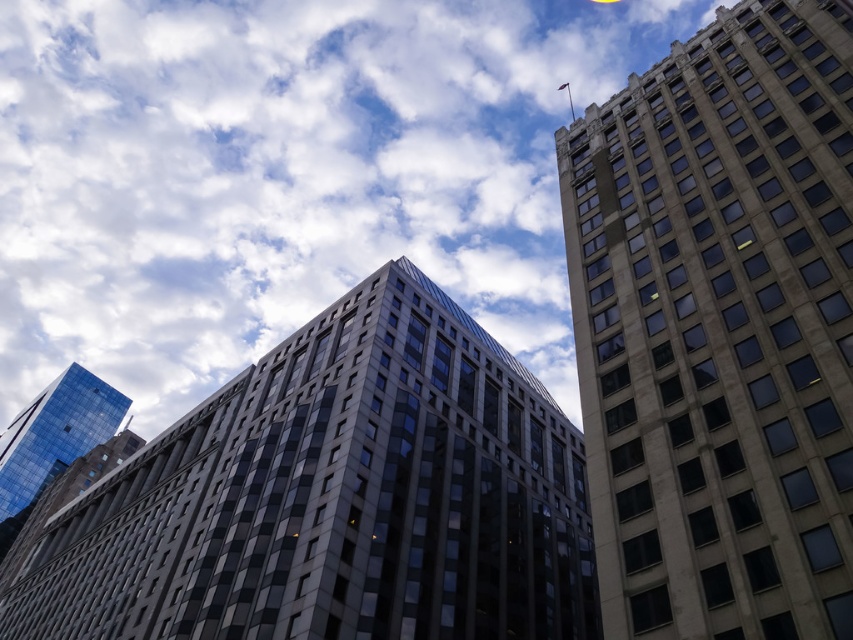
You are an architect evaluating the cityscape. You need to determine which object, the white fluffy cloud at upper center or the matte glass building at center, has a greater height in the image. Based on the scene description, which one is taller?

The white fluffy cloud at upper center is taller than the matte glass building at center according to the description.

You are an architect evaluating the city skyline. You notice the matte glass building at center and the shiny glass skyscraper at lower left. Which building has a greater height?

The matte glass building at center is taller than the shiny glass skyscraper at lower left according to the description.